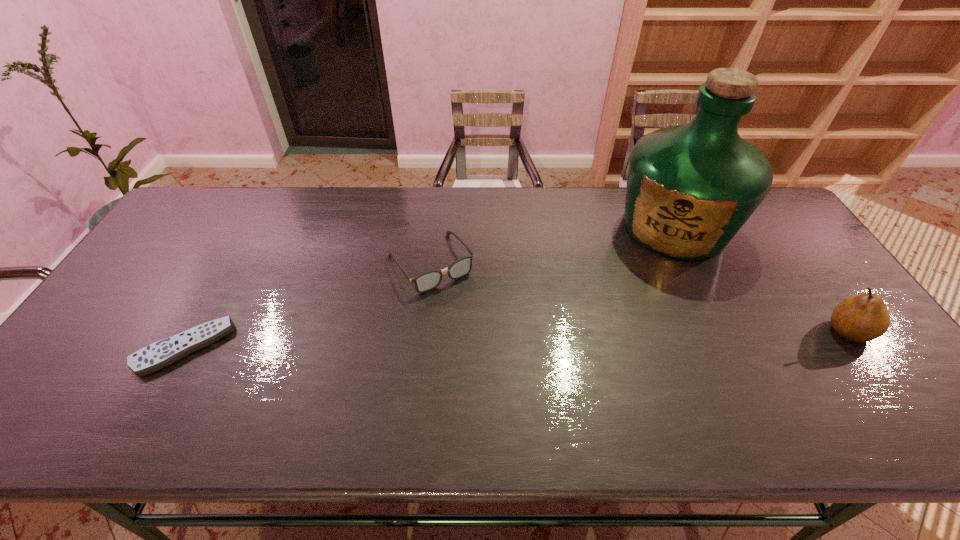
Image resolution: width=960 pixels, height=540 pixels. I want to click on free space located 0.070m on the face of the spectacles, so click(463, 309).

Locate an element on the screen. The height and width of the screenshot is (540, 960). vacant space located 0.220m on the face of the spectacles is located at coordinates (491, 349).

The height and width of the screenshot is (540, 960). I want to click on vacant space located on the face of the spectacles, so click(473, 325).

In order to click on free region located 0.330m on the label side of the liquor in this screenshot , I will do `click(613, 336)`.

This screenshot has height=540, width=960. I want to click on vacant space located on the label side of the liquor, so click(603, 356).

The height and width of the screenshot is (540, 960). What are the coordinates of `vacant space located on the label side of the liquor` in the screenshot? It's located at (646, 278).

At what (x,y) coordinates should I click in order to perform the action: click on object positioned at the far edge. Please return your answer as a coordinate pair (x, y). The height and width of the screenshot is (540, 960). Looking at the image, I should click on (690, 188).

You are a GUI agent. You are given a task and a screenshot of the screen. Output one action in this format:
    pyautogui.click(x=<x>, y=<y>)
    Task: Click on the object located at the near edge
    
    Given the screenshot: What is the action you would take?
    pyautogui.click(x=162, y=353)

This screenshot has height=540, width=960. Identify the location of object that is at the left edge. (162, 353).

You are a GUI agent. You are given a task and a screenshot of the screen. Output one action in this format:
    pyautogui.click(x=<x>, y=<y>)
    Task: Click on the object that is at the right edge
    This screenshot has width=960, height=540.
    Given the screenshot: What is the action you would take?
    pyautogui.click(x=864, y=317)